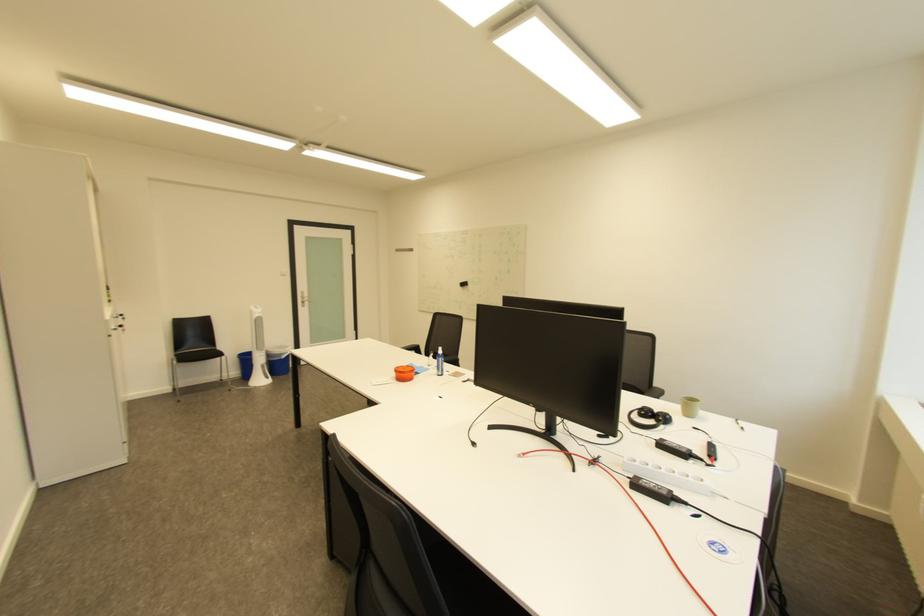
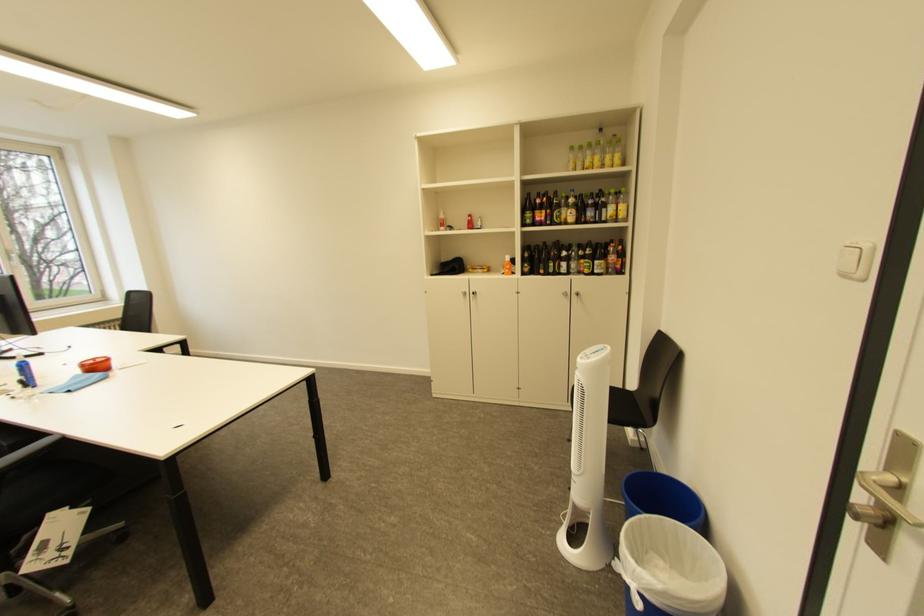
Find the pixel in the second image that matches [293,276] in the first image.

(855, 277)